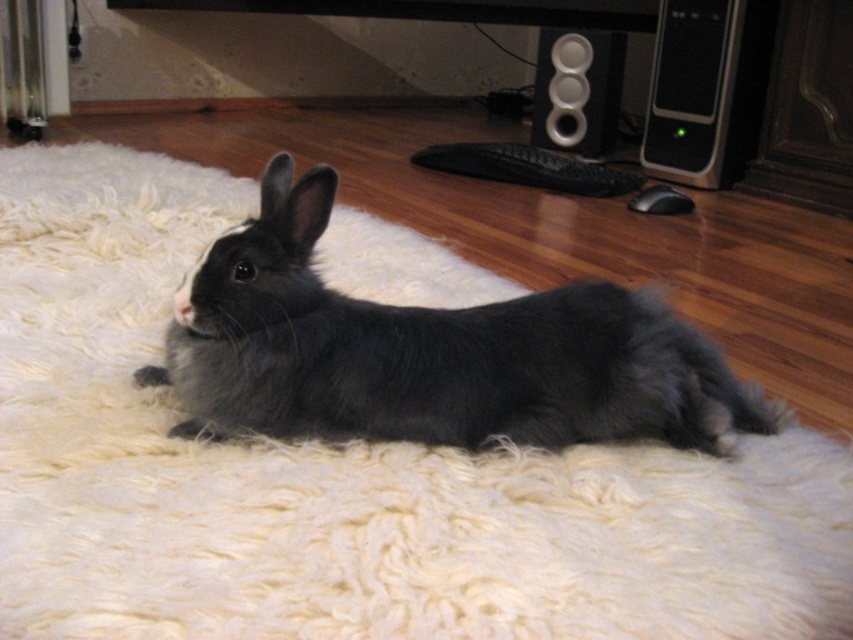
You are organizing a cozy home office setup. You have a black soft fur rabbit at center and a satin black speaker at center right. Where should you place a new plant so that it is between them?

The plant should be placed between the black soft fur rabbit at center and the satin black speaker at center right, positioning it above the rabbit and below the speaker since the rabbit is below the speaker.

You are trying to locate two specific points in the image. The first point is at coordinates point(650, 124) and the second is at point(601, 35). From the rabbit lying on the rug, which point is closer to you?

Point(650, 124) is in front of point(601, 35), so it is closer to you.